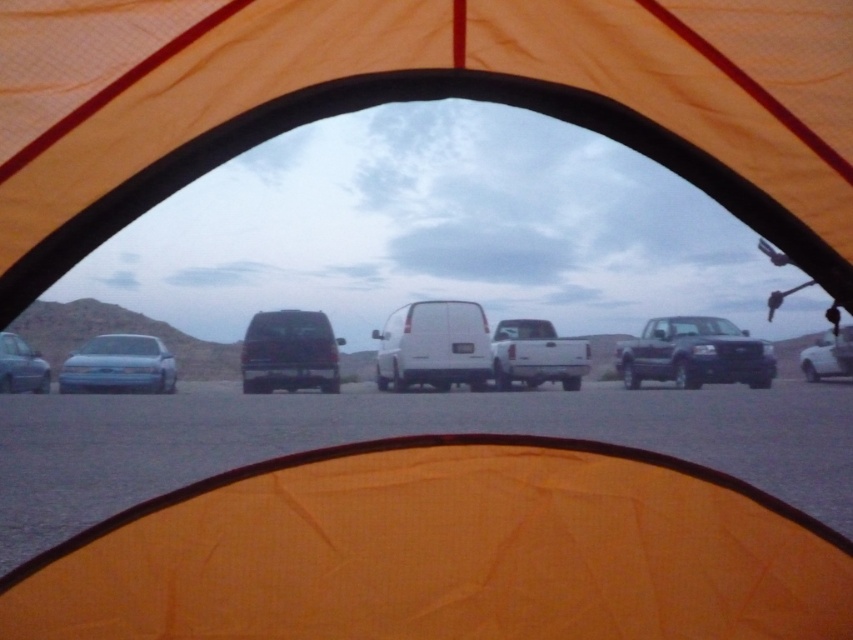
Is point (271, 353) less distant than point (44, 385)?

Yes, point (271, 353) is in front of point (44, 385).

Is dark gray matte van at center below matte silver sedan at left?

No.

Locate an element on the screen. dark gray matte van at center is located at coordinates (289, 353).

The height and width of the screenshot is (640, 853). I want to click on dark gray matte van at center, so click(x=289, y=353).

Measure the distance between white matte truck at center and matte silver sedan at left.

white matte truck at center is 11.35 feet from matte silver sedan at left.

Is white matte truck at center positioned behind matte silver sedan at left?

No, it is not.

Which is behind, point (572, 364) or point (26, 358)?

The point (26, 358) is more distant.

Locate an element on the screen. The image size is (853, 640). white matte truck at center is located at coordinates (537, 355).

Does white matte van at center lie in front of white matte truck at center?

Yes, it is in front of white matte truck at center.

Can you confirm if white matte van at center is smaller than white matte truck at center?

No.

I want to click on white matte van at center, so click(433, 346).

Locate an element on the screen. white matte van at center is located at coordinates (433, 346).